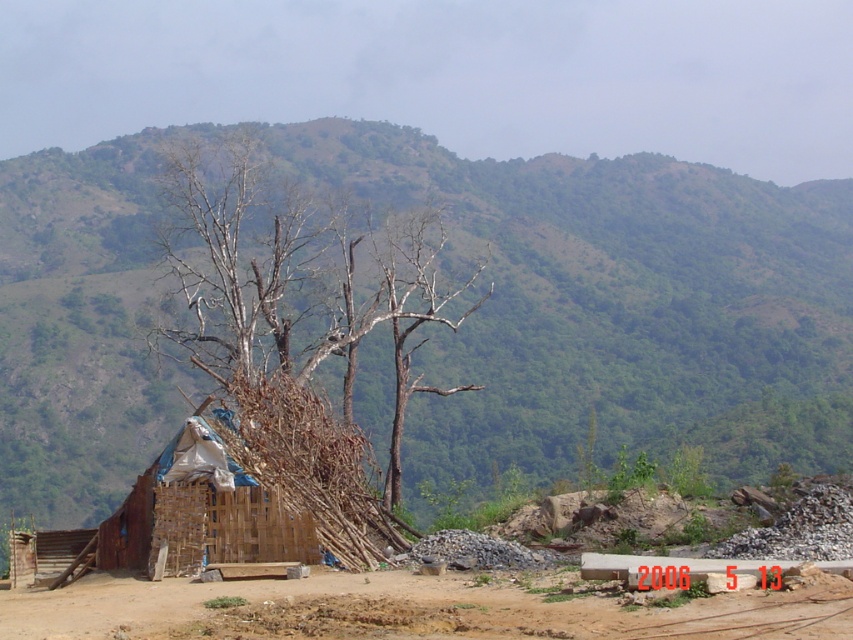
Can you confirm if brown dirt field at lower center is thinner than wooden hut at lower left?

No, brown dirt field at lower center is not thinner than wooden hut at lower left.

Measure the distance between point (341, 630) and camera.

11.81 meters

Image resolution: width=853 pixels, height=640 pixels. What do you see at coordinates (413, 609) in the screenshot? I see `brown dirt field at lower center` at bounding box center [413, 609].

You are a GUI agent. You are given a task and a screenshot of the screen. Output one action in this format:
    pyautogui.click(x=<x>, y=<y>)
    Task: Click on the brown dirt field at lower center
    The image size is (853, 640).
    Given the screenshot: What is the action you would take?
    pyautogui.click(x=413, y=609)

Is green leafy mountain at upper center wider than brown dirt field at lower center?

Yes.

Who is more forward, (506, 392) or (143, 582)?

Point (143, 582)

Identify the location of green leafy mountain at upper center. (612, 305).

Who is higher up, green leafy mountain at upper center or brown dry wood at center?

Positioned higher is green leafy mountain at upper center.

Who is positioned more to the right, green leafy mountain at upper center or brown dry wood at center?

green leafy mountain at upper center is more to the right.

Looking at this image, measure the distance between point (715, 470) and camera.

The distance of point (715, 470) from camera is 142.85 feet.

You are a GUI agent. You are given a task and a screenshot of the screen. Output one action in this format:
    pyautogui.click(x=<x>, y=<y>)
    Task: Click on the green leafy mountain at upper center
    
    Given the screenshot: What is the action you would take?
    pyautogui.click(x=612, y=305)